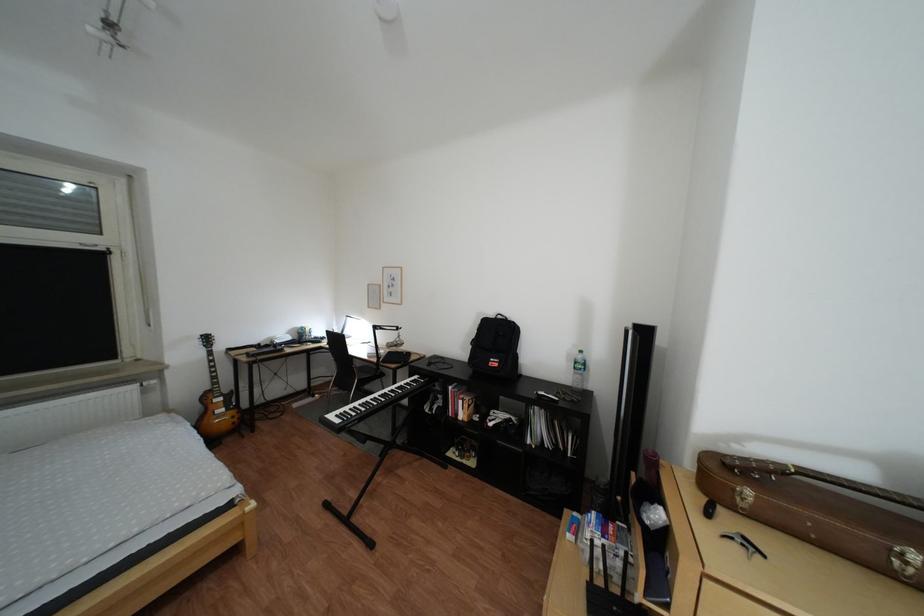
Find the location of a particular element. Image resolution: width=924 pixels, height=616 pixels. chair sitting surface is located at coordinates (365, 373).